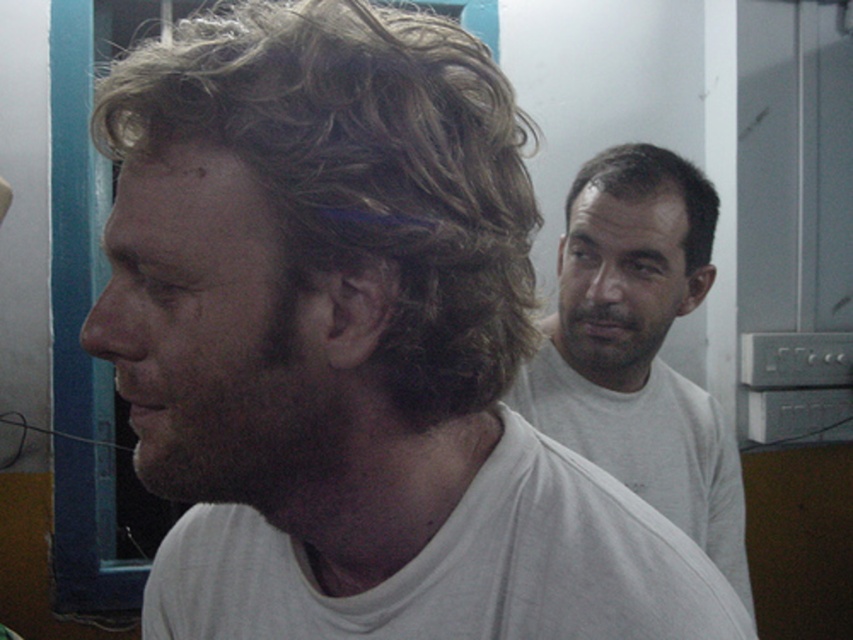
Does white cotton t-shirt at center appear under white cotton shirt at right?

Yes.

Does white cotton t-shirt at center have a larger size compared to white cotton shirt at right?

No, white cotton t-shirt at center is not bigger than white cotton shirt at right.

This screenshot has width=853, height=640. What are the coordinates of `white cotton t-shirt at center` in the screenshot? It's located at (459, 566).

Who is taller, brown curly hair at left or dark brown hair at upper right?

A: Standing taller between the two is brown curly hair at left.

Where is `brown curly hair at left`? This screenshot has height=640, width=853. brown curly hair at left is located at coordinates (363, 168).

Where is `brown curly hair at left`? This screenshot has height=640, width=853. brown curly hair at left is located at coordinates (363, 168).

Does white cotton shirt at right have a greater width compared to dark brown fuzzy beard at left?

Yes, white cotton shirt at right is wider than dark brown fuzzy beard at left.

Who is positioned more to the right, white cotton shirt at right or dark brown fuzzy beard at left?

white cotton shirt at right is more to the right.

Locate an element on the screen. The width and height of the screenshot is (853, 640). white cotton shirt at right is located at coordinates (637, 346).